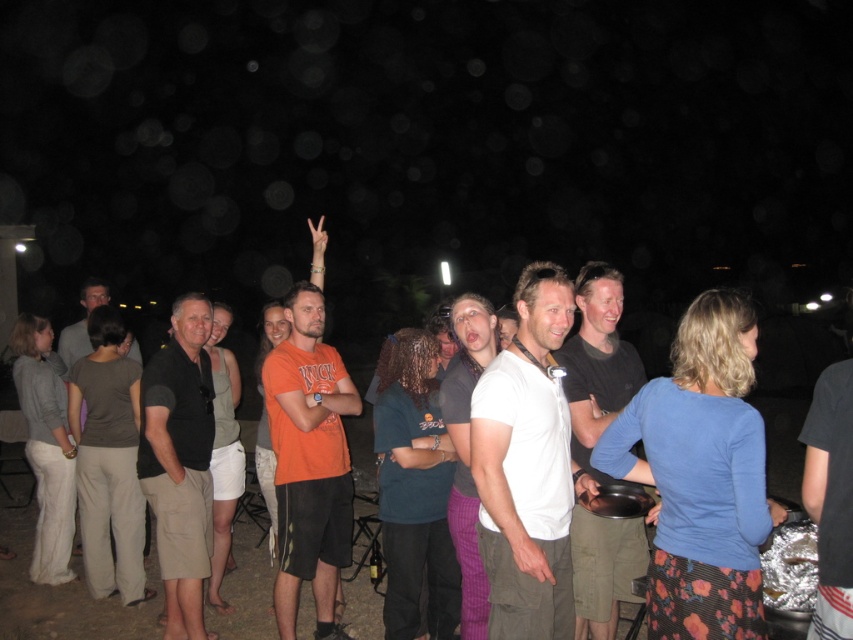
Can you confirm if white matte t-shirt at center is taller than orange cotton t-shirt at center?

No.

Between white matte t-shirt at center and orange cotton t-shirt at center, which one appears on the left side from the viewer's perspective?

orange cotton t-shirt at center

This screenshot has width=853, height=640. What do you see at coordinates (527, 467) in the screenshot? I see `white matte t-shirt at center` at bounding box center [527, 467].

Find the location of a particular element. white matte t-shirt at center is located at coordinates (527, 467).

Where is `white matte t-shirt at center`? This screenshot has height=640, width=853. white matte t-shirt at center is located at coordinates (527, 467).

Is white matte t-shirt at center bigger than black cotton shirt at center?

Yes, white matte t-shirt at center is bigger than black cotton shirt at center.

Between point (515, 628) and point (157, 422), which one is positioned behind?

The point (157, 422) is more distant.

Where is `white matte t-shirt at center`? white matte t-shirt at center is located at coordinates (527, 467).

Who is more distant from viewer, (190,573) or (80,292)?

Positioned behind is point (80,292).

Can you confirm if black cotton shirt at center is wider than dark gray shirt at left?

No.

Does point (194, 468) come behind point (62, 344)?

No, it is not.

Where is `black cotton shirt at center`? This screenshot has width=853, height=640. black cotton shirt at center is located at coordinates (178, 460).